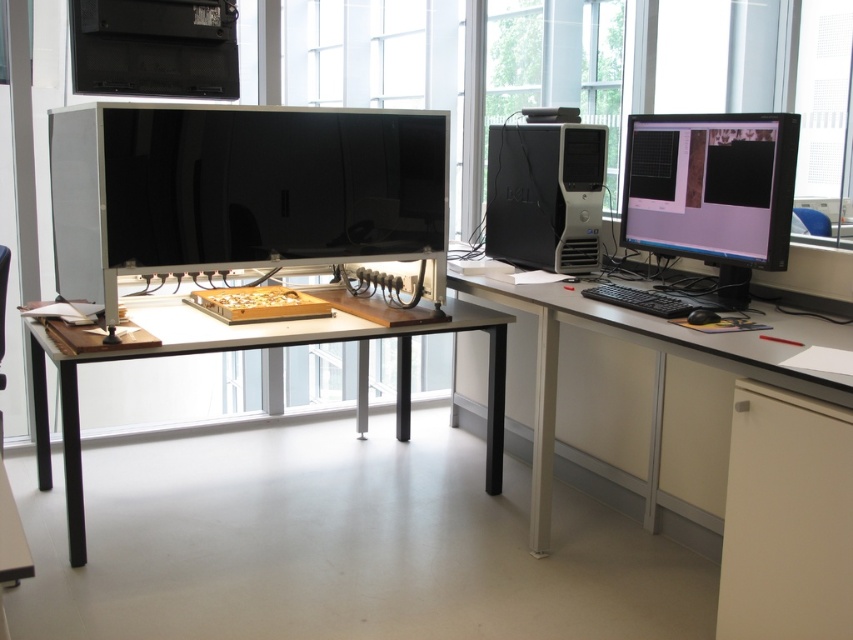
You are standing at the entrance of the laboratory and need to locate the matte black monitor at right. According to the room layout, where should you look relative to the large windows?

The matte black monitor at right is located at point 0.292 on the horizontal axis and 0.835 on the vertical axis, so you should look towards the lower right area of the room relative to the large windows.

You are a researcher in the lab and need to access the black matte keyboard at right. The monitor is blocking your view. Can you reach the keyboard without moving the matte black monitor at right?

The matte black monitor at right is in front of the black matte keyboard at right, so you cannot reach the keyboard without moving the monitor.